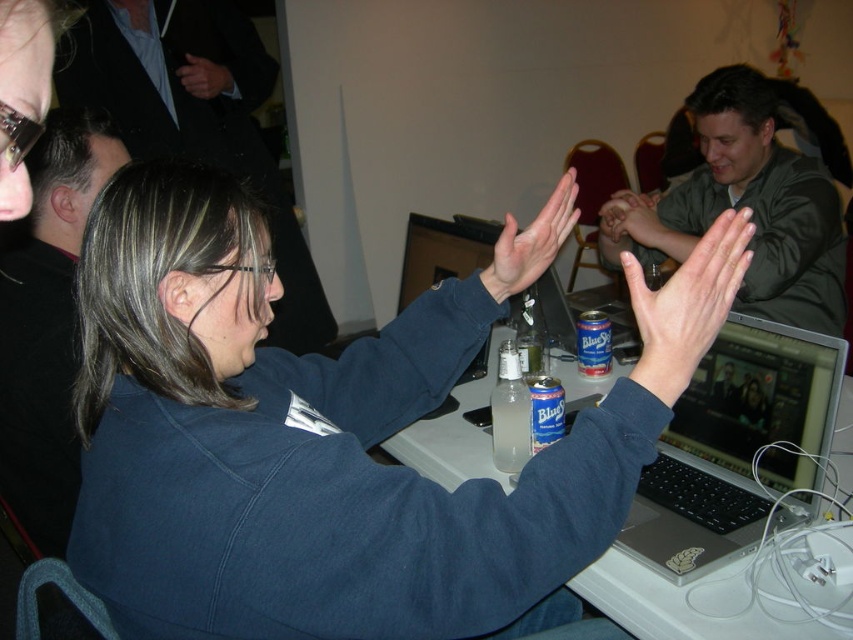
Between point (776, 273) and point (605, 586), which one is positioned in front?

Positioned in front is point (605, 586).

Is green matte jacket at center to the left of white plastic table at center from the viewer's perspective?

In fact, green matte jacket at center is to the right of white plastic table at center.

The height and width of the screenshot is (640, 853). I want to click on green matte jacket at center, so click(x=746, y=205).

Where is `green matte jacket at center`? The width and height of the screenshot is (853, 640). green matte jacket at center is located at coordinates (746, 205).

Is smooth skin hand at center closer to camera compared to matte blue sweater at center?

Yes, smooth skin hand at center is in front of matte blue sweater at center.

Is smooth skin hand at center thinner than matte blue sweater at center?

Correct, smooth skin hand at center's width is less than matte blue sweater at center's.

You are a GUI agent. You are given a task and a screenshot of the screen. Output one action in this format:
    pyautogui.click(x=<x>, y=<y>)
    Task: Click on the smooth skin hand at center
    
    Given the screenshot: What is the action you would take?
    pyautogui.click(x=686, y=305)

Between black matte jacket at upper left and translucent glass bottle at center, which one appears on the right side from the viewer's perspective?

translucent glass bottle at center is more to the right.

Based on the photo, is black matte jacket at upper left closer to camera compared to translucent glass bottle at center?

Yes.

Image resolution: width=853 pixels, height=640 pixels. I want to click on black matte jacket at upper left, so click(47, 323).